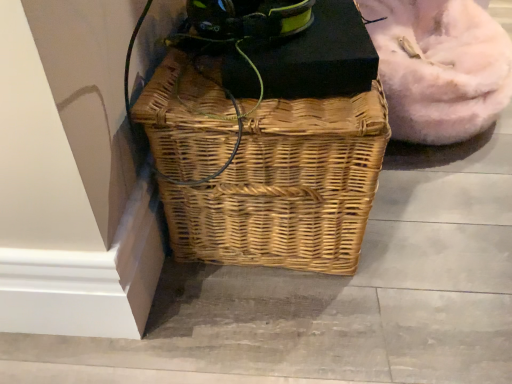
Locate an element on the screen. Image resolution: width=512 pixels, height=384 pixels. vacant area to the right of natural wicker picnic basket at center is located at coordinates (438, 217).